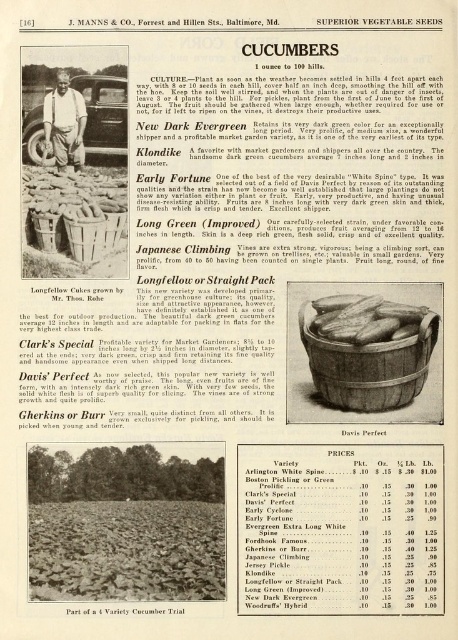
Which of these two, wooden barrel at center or green matte cucumber at center, stands shorter?

green matte cucumber at center is shorter.

Is wooden barrel at center thinner than green matte cucumber at center?

No, wooden barrel at center is not thinner than green matte cucumber at center.

Locate an element on the screen. Image resolution: width=458 pixels, height=640 pixels. wooden barrel at center is located at coordinates (367, 365).

Is point (300, 333) farther from viewer compared to point (407, 323)?

Yes, it is behind point (407, 323).

Does wooden barrel at center have a smaller size compared to smooth brown basket at center?

Actually, wooden barrel at center might be larger than smooth brown basket at center.

Does point (415, 333) lie behind point (356, 296)?

No, (415, 333) is in front of (356, 296).

Locate an element on the screen. The height and width of the screenshot is (640, 458). wooden barrel at center is located at coordinates (367, 365).

Is light brown wooden chair at center smaller than matte brown wicker basket at center?

Actually, light brown wooden chair at center might be larger than matte brown wicker basket at center.

Who is more forward, (82, 129) or (44, 248)?

Point (82, 129) is in front.

Which is behind, point (52, 116) or point (34, 211)?

The point (34, 211) is more distant.

Identify the location of light brown wooden chair at center. This screenshot has width=458, height=640. (64, 124).